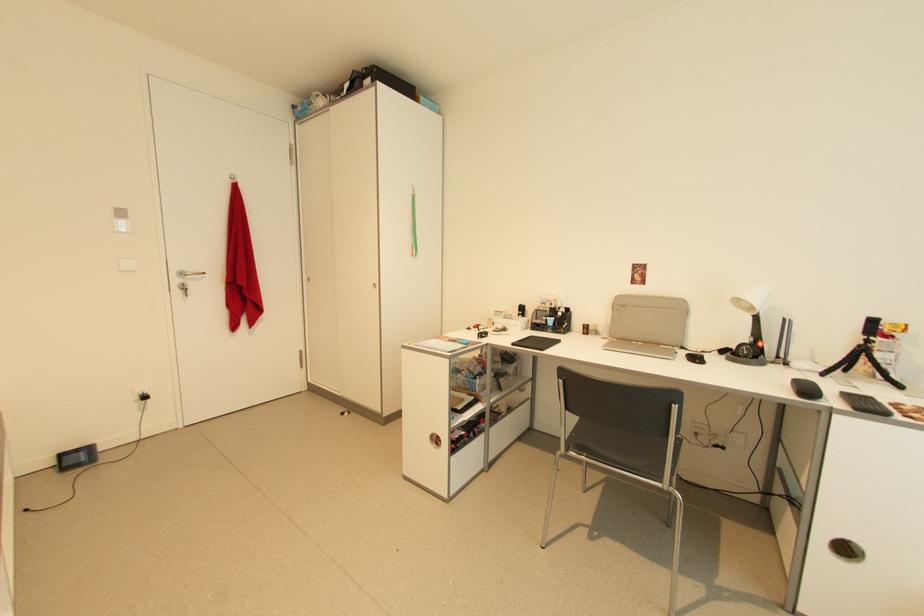
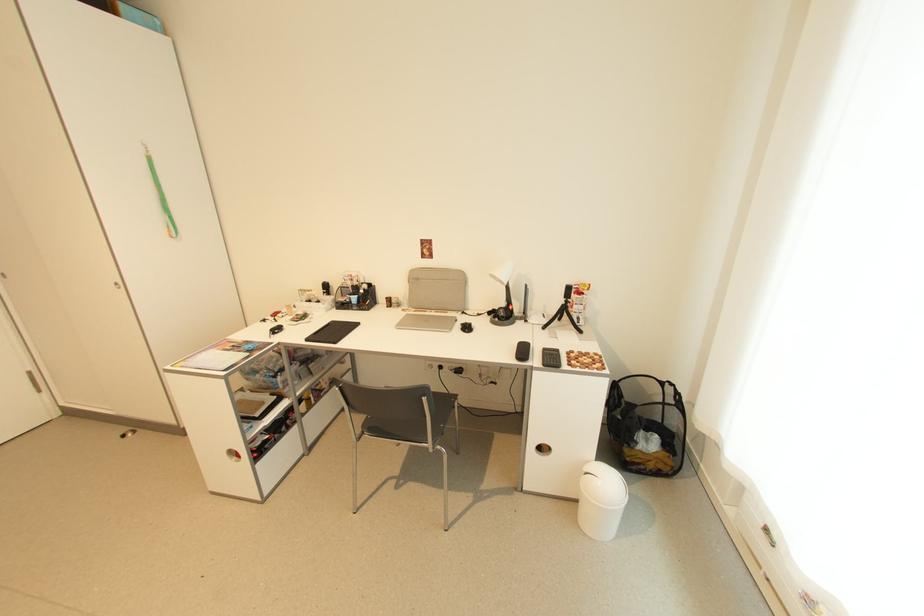
Where in the second image is the point corresponding to pixel 436 445 from the first image?

(237, 460)